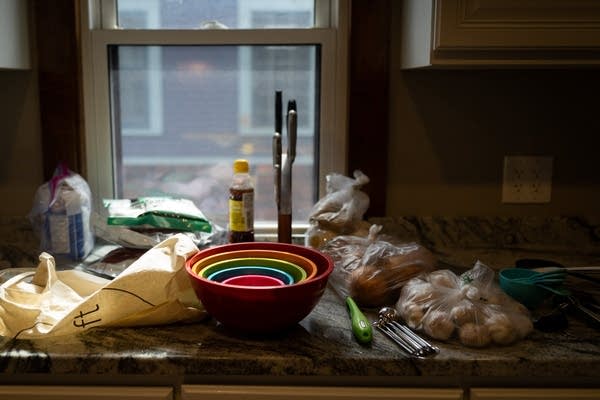
You are a GUI agent. You are given a task and a screenshot of the screen. Output one action in this format:
    pyautogui.click(x=<x>, y=<y>)
    Task: Click on the windows
    This screenshot has width=600, height=400.
    Given the screenshot: What is the action you would take?
    pyautogui.click(x=137, y=89), pyautogui.click(x=206, y=111), pyautogui.click(x=277, y=66)